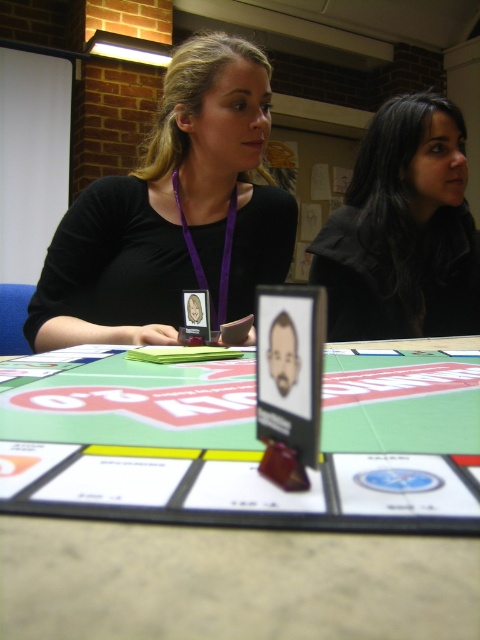
Can you confirm if green board game at center is smaller than matte black lanyard at center?

Correct, green board game at center occupies less space than matte black lanyard at center.

Who is shorter, green board game at center or matte black lanyard at center?

Standing shorter between the two is green board game at center.

Is point (57, 577) closer to viewer compared to point (121, 336)?

Yes, it is.

I want to click on green board game at center, so click(x=230, y=582).

Does green board game at center have a smaller size compared to black matte hair at upper right?

Yes.

Which is more to the right, green board game at center or black matte hair at upper right?

From the viewer's perspective, black matte hair at upper right appears more on the right side.

Who is more distant from viewer, (210, 540) or (368, 278)?

Positioned behind is point (368, 278).

This screenshot has width=480, height=640. Find the location of `green board game at center`. green board game at center is located at coordinates (230, 582).

Who is positioned more to the right, matte black lanyard at center or black matte hair at upper right?

black matte hair at upper right is more to the right.

Is matte black lanyard at center above black matte hair at upper right?

No, matte black lanyard at center is not above black matte hair at upper right.

Identify the location of matte black lanyard at center. (173, 212).

In order to click on matte black lanyard at center in this screenshot , I will do `click(173, 212)`.